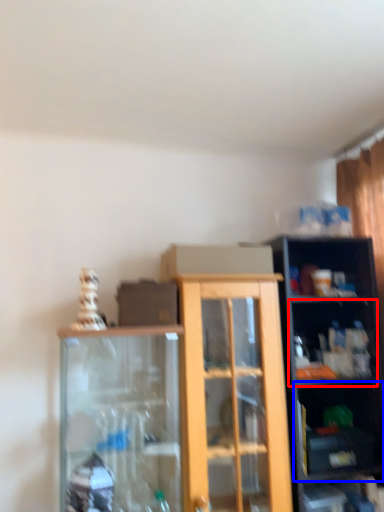
Question: Among these objects, which one is nearest to the camera, shelf (highlighted by a red box) or shelf (highlighted by a blue box)?

Choices:
 (A) shelf
 (B) shelf

Answer: (B)